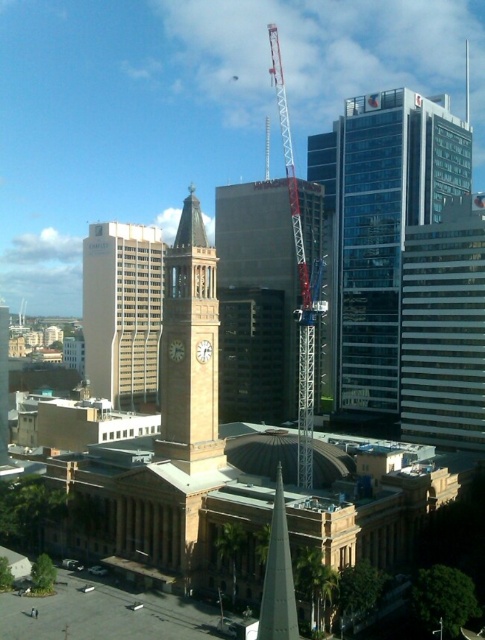
You are a city planner assessing the view of the beige stone clock tower at center and the metallic red crane at center from a new park being built. Based on their positions, which structure will appear closer to the park visitors?

The beige stone clock tower at center is in front of the metallic red crane at center, so it will appear closer to the park visitors.

You are standing at the center of the image and want to take a photo of the clear glass skyscraper at right. Which direction should you turn to face it?

The clear glass skyscraper at right is located to your right side, so you should turn to your right to face it.